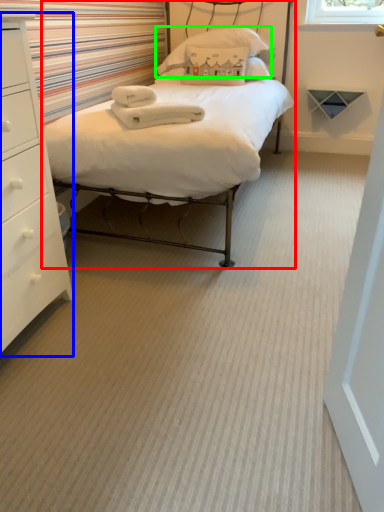
Question: Considering the real-world distances, which object is farthest from bed (highlighted by a red box)? chest of drawers (highlighted by a blue box) or pillow (highlighted by a green box)?

Choices:
 (A) chest of drawers
 (B) pillow

Answer: (B)